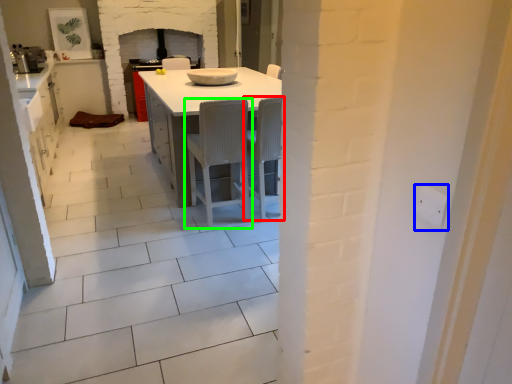
Question: Considering the real-world distances, which object is farthest from chair (highlighted by a red box)? electric outlet (highlighted by a blue box) or chair (highlighted by a green box)?

Choices:
 (A) electric outlet
 (B) chair

Answer: (A)